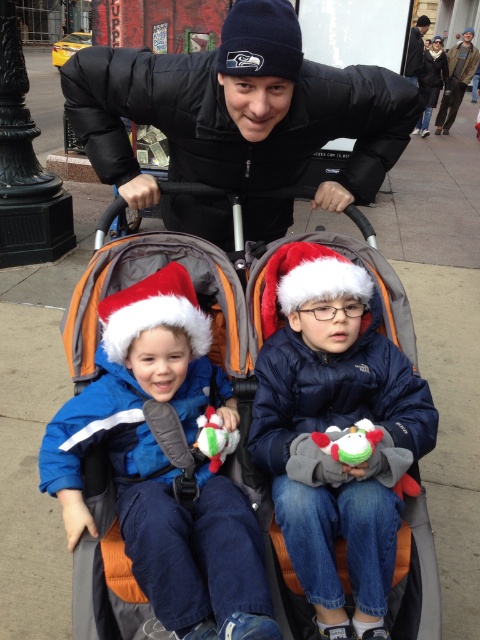
You are a photographer trying to capture a clear shot of the black matte jacket at upper center and the dark blue knit hat at upper center. Since you want to focus on the smaller object, which one should you zoom in on?

The black matte jacket at upper center is smaller than the dark blue knit hat at upper center, so you should zoom in on the black matte jacket at upper center to focus on the smaller object.

You are a delivery person trying to navigate a narrow alleyway that is only 1.2 meters wide. You have an orange fabric baby carriage at center and a navy blue jacket at center with you. Can both items fit side by side in the alleyway without overlapping?

The orange fabric baby carriage at center is wider than the navy blue jacket at center. Since the alleyway is only 1.2 meters wide, it depends on the combined width of both items. However, the description only states the carriage is wider, not the exact dimensions. Without knowing the exact widths, we cannot definitively say if they fit.